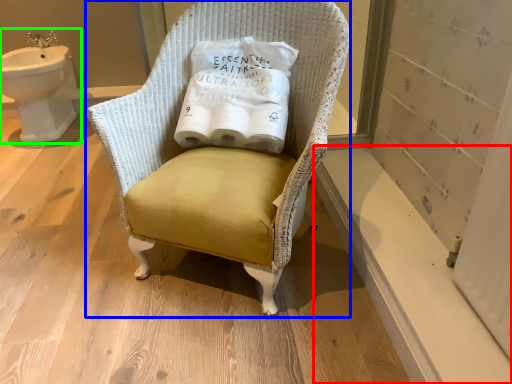
Question: Which object is positioned closest to window sill (highlighted by a red box)? Select from chair (highlighted by a blue box) and sink (highlighted by a green box).

Choices:
 (A) chair
 (B) sink

Answer: (A)